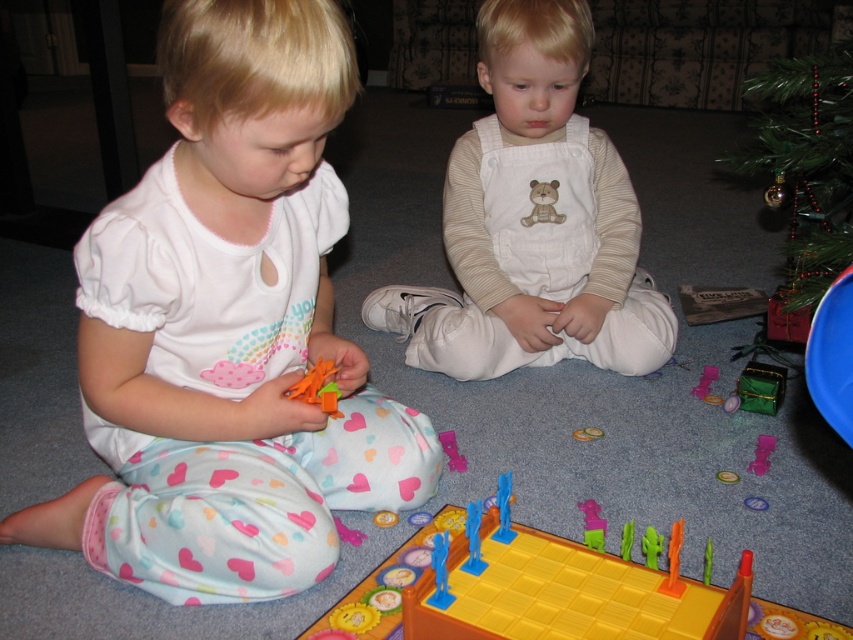
Does translucent plastic toy at center have a greater width compared to pink plastic toy at lower right?

Yes.

Does point (300, 385) come closer to viewer compared to point (704, 369)?

Yes, point (300, 385) is closer to viewer.

Is point (312, 392) farther from viewer compared to point (705, 369)?

No, it is not.

I want to click on translucent plastic toy at center, so click(318, 387).

Is soft plush bear at center above pink plastic toy at center?

Correct, soft plush bear at center is located above pink plastic toy at center.

Who is positioned more to the right, soft plush bear at center or pink plastic toy at center?

pink plastic toy at center is more to the right.

This screenshot has width=853, height=640. Identify the location of soft plush bear at center. (543, 204).

Can you confirm if matte white shirt at center is shorter than soft plush bear at center?

In fact, matte white shirt at center may be taller than soft plush bear at center.

Between point (177, 64) and point (531, 220), which one is positioned in front?

Point (177, 64) is in front.

Where is `matte white shirt at center`? The height and width of the screenshot is (640, 853). matte white shirt at center is located at coordinates (x=228, y=330).